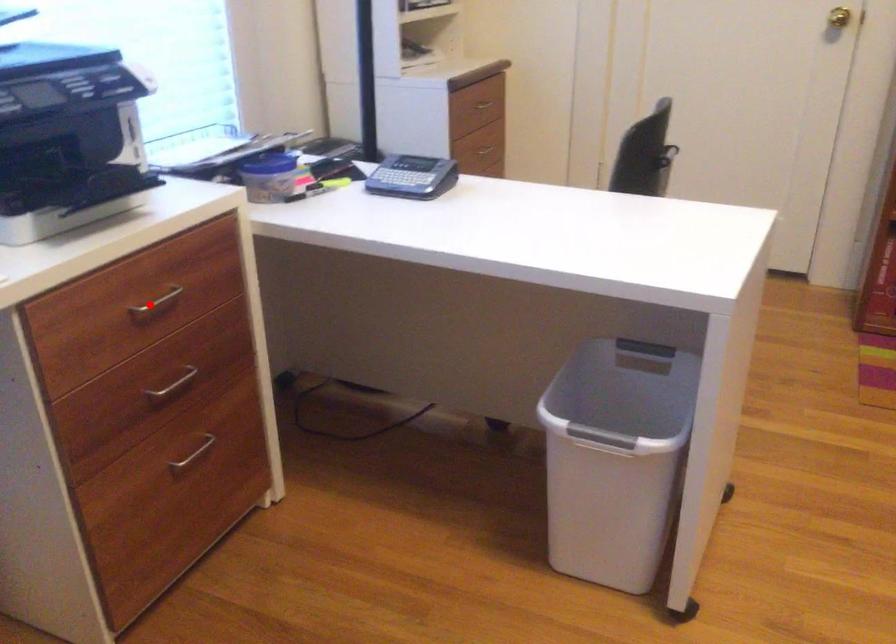
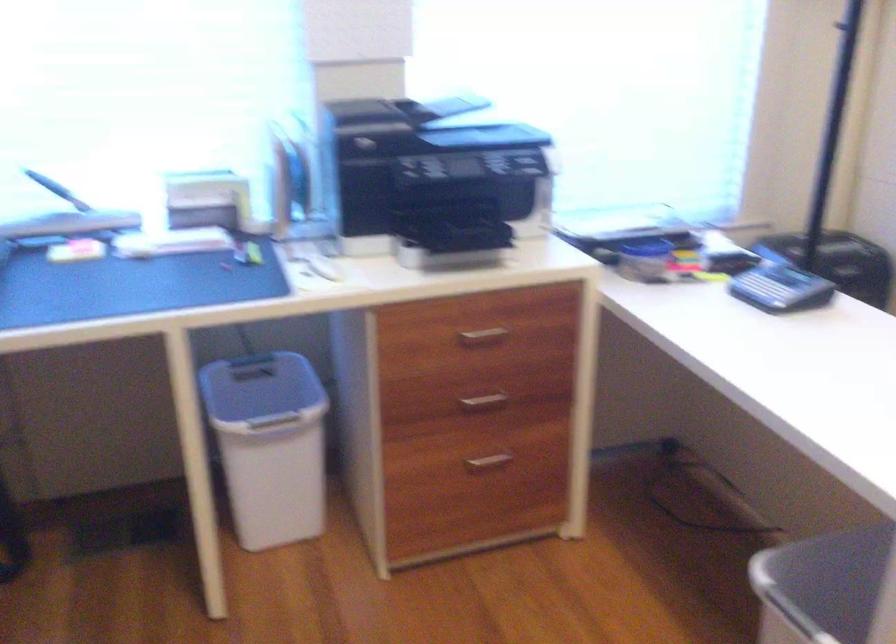
Question: I am providing you with two images of the same scene from different viewpoints. Given a red point in image1, look at the same physical point in image2. Is it:

Choices:
 (A) Closer to the viewpoint
 (B) Farther from the viewpoint

Answer: (B)